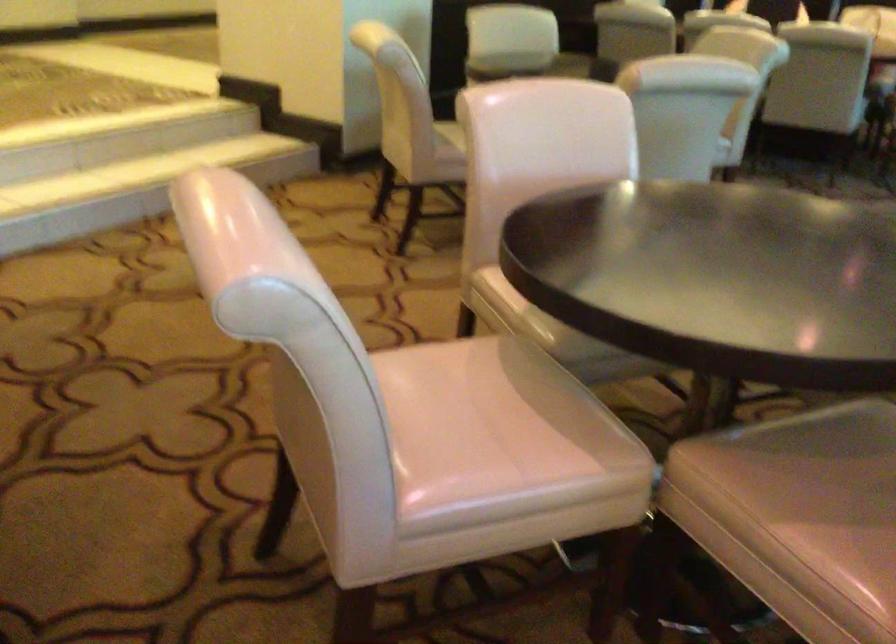
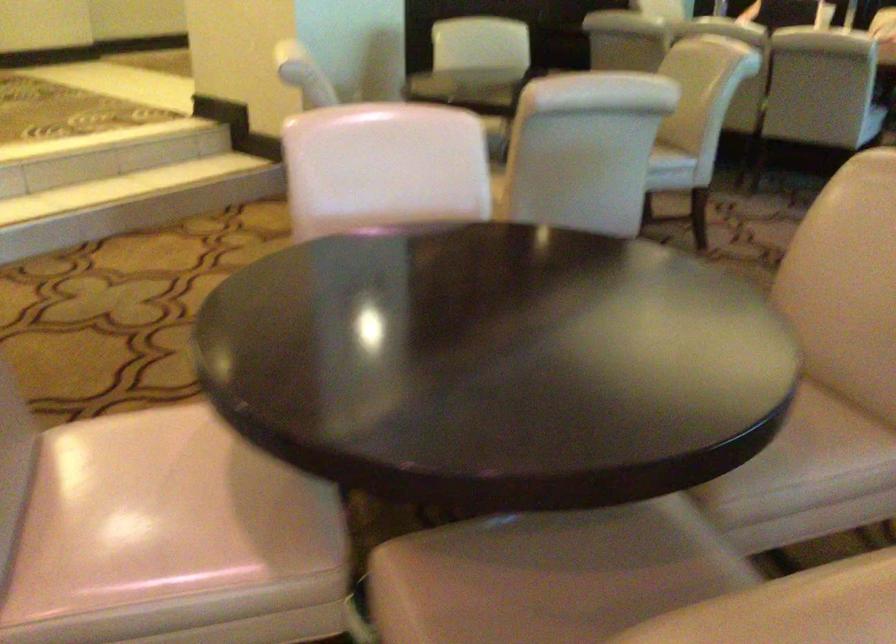
Locate, in the second image, the point that corresponds to (825,469) in the first image.

(556, 585)